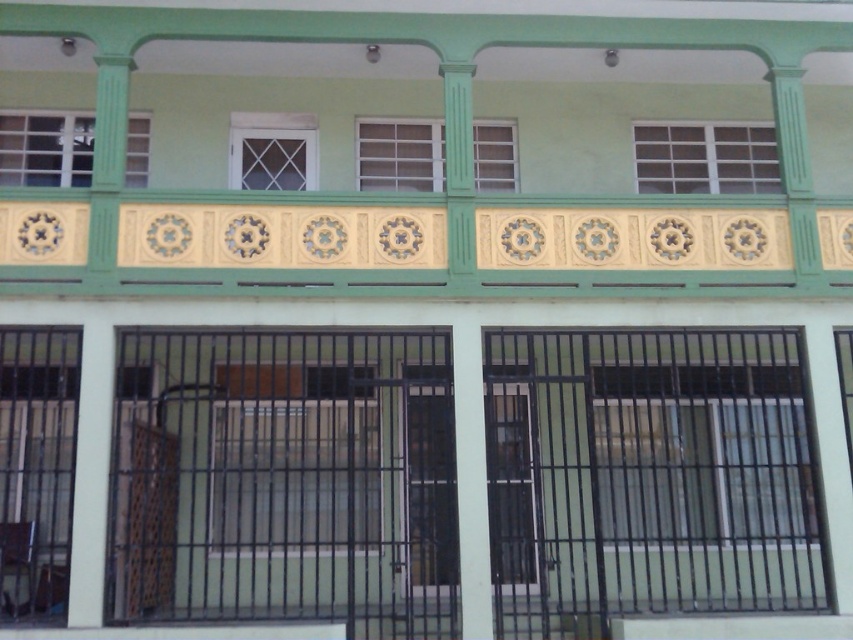
Question: Is white plastic window at upper center to the left of white lattice window at center from the viewer's perspective?

Choices:
 (A) yes
 (B) no

Answer: (B)

Question: Can you confirm if white plastic window at upper center is thinner than white plastic window at center?

Choices:
 (A) yes
 (B) no

Answer: (B)

Question: Which point is farther to the camera?

Choices:
 (A) (354, 378)
 (B) (764, 29)
 (C) (635, 136)

Answer: (C)

Question: Which object is farther from the camera taking this photo?

Choices:
 (A) matte green window at upper left
 (B) white plastic window at upper center
 (C) yellow matte tile at upper center

Answer: (B)

Question: Is white plastic window at upper center positioned at the back of white lattice window at center?

Choices:
 (A) yes
 (B) no

Answer: (A)

Question: Considering the real-world distances, which object is farthest from the white lattice window at center?

Choices:
 (A) matte green window at upper left
 (B) white plastic window at upper center

Answer: (B)